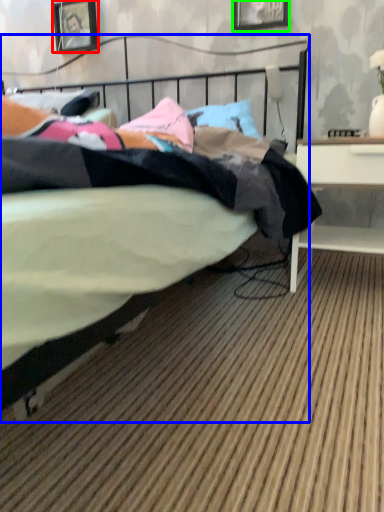
Question: Which object is the closest to the picture frame (highlighted by a red box)? Choose among these: bed (highlighted by a blue box) or picture frame (highlighted by a green box).

Choices:
 (A) bed
 (B) picture frame

Answer: (B)